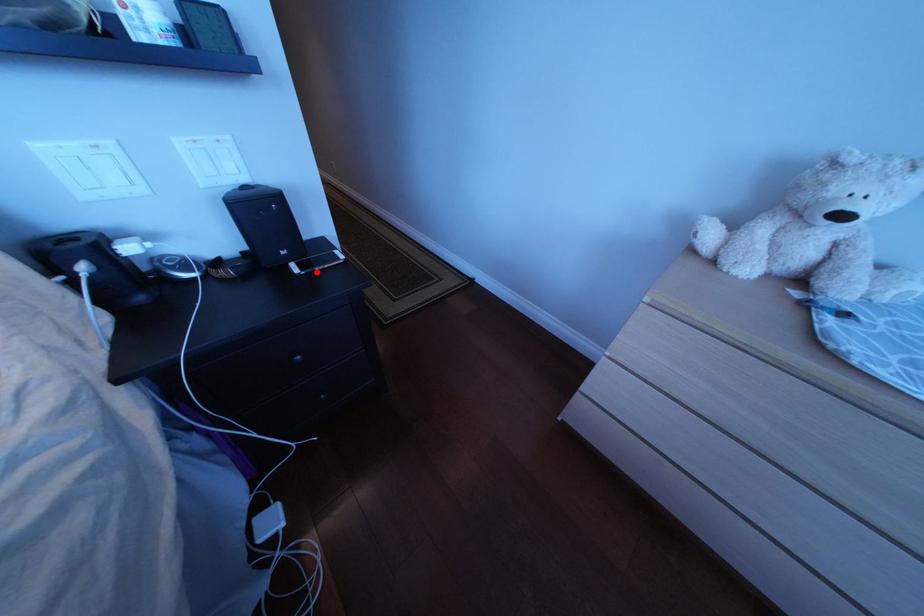
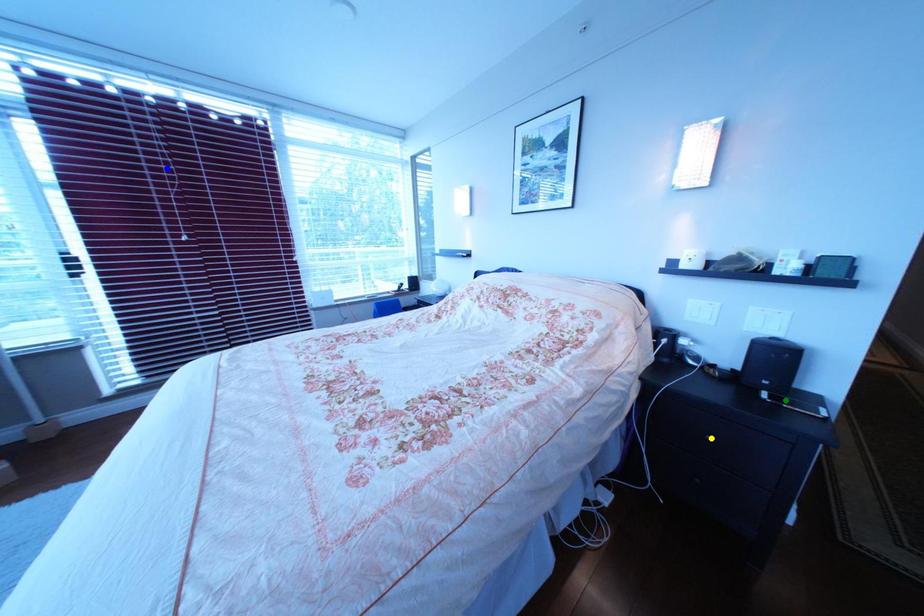
Question: I am providing you with two images of the same scene from different viewpoints. A red point is marked on the first image. You are given multiple points on the second image. Which point in image 2 is actually the same real-world point as the red point in image 1?

Choices:
 (A) blue point
 (B) green point
 (C) yellow point

Answer: (B)